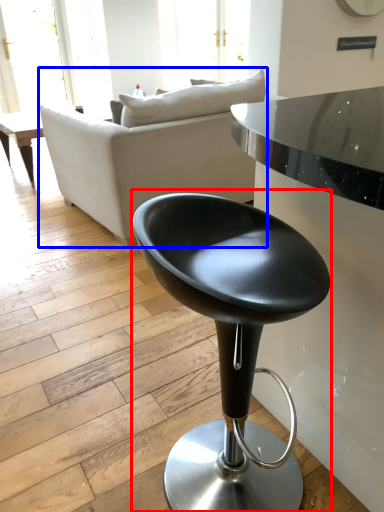
Question: Which point is closer to the camera, chair (highlighted by a red box) or studio couch (highlighted by a blue box)?

Choices:
 (A) chair
 (B) studio couch

Answer: (A)